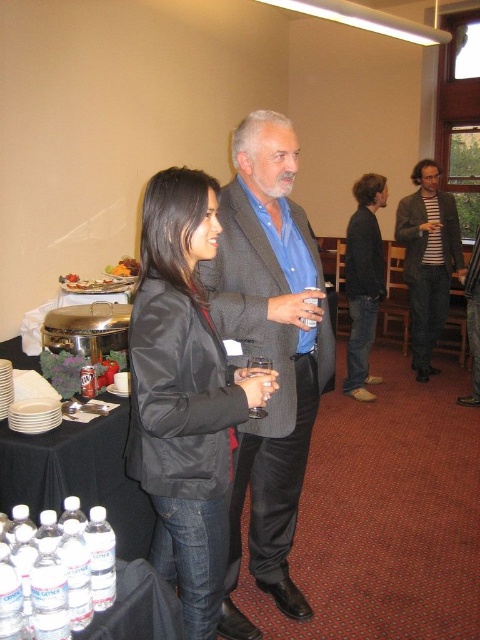
Question: Which object appears closest to the camera in this image?

Choices:
 (A) clear plastic water bottles at lower left
 (B) clear plastic water bottle at lower left
 (C) striped cotton shirt at upper right

Answer: (B)

Question: Estimate the real-world distances between objects in this image. Which object is farther from the clear plastic bottles at lower left?

Choices:
 (A) satin black blazer at center
 (B) smooth brown bread at left

Answer: (B)

Question: Can you confirm if striped cotton shirt at upper right is thinner than clear plastic water bottle at lower left?

Choices:
 (A) no
 (B) yes

Answer: (A)

Question: Is the position of satin black blazer at center less distant than that of smooth brown bread at left?

Choices:
 (A) yes
 (B) no

Answer: (A)

Question: Which object is the closest to the striped cotton shirt at upper right?

Choices:
 (A) clear plastic bottles at lower left
 (B) gray wool suit at center
 (C) clear plastic water bottles at lower left

Answer: (B)

Question: Observing the image, what is the correct spatial positioning of white plastic water bottles at lower left in reference to smooth brown bread at left?

Choices:
 (A) above
 (B) below

Answer: (B)